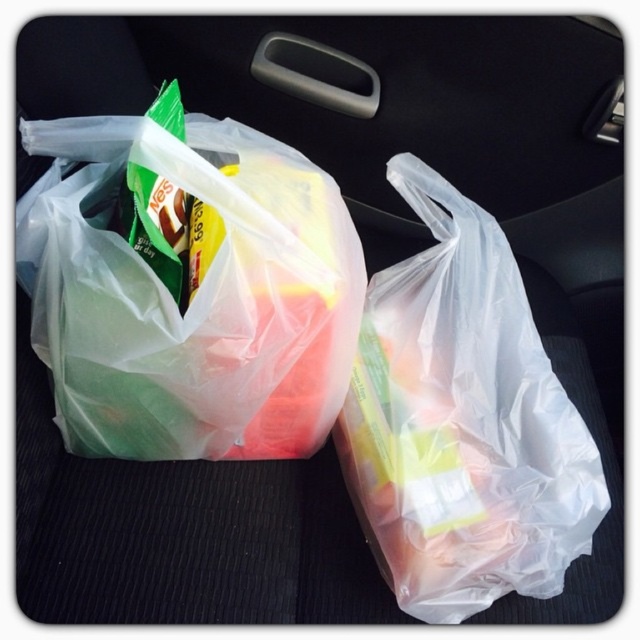
Question: Does translucent plastic bag at left appear under transparent plastic bag at center?

Choices:
 (A) no
 (B) yes

Answer: (A)

Question: Which point appears closest to the camera in this image?

Choices:
 (A) (182, 449)
 (B) (390, 307)

Answer: (A)

Question: Does translucent plastic bag at left have a smaller size compared to transparent plastic bag at center?

Choices:
 (A) yes
 (B) no

Answer: (B)

Question: Is translucent plastic bag at left positioned at the back of transparent plastic bag at center?

Choices:
 (A) no
 (B) yes

Answer: (A)